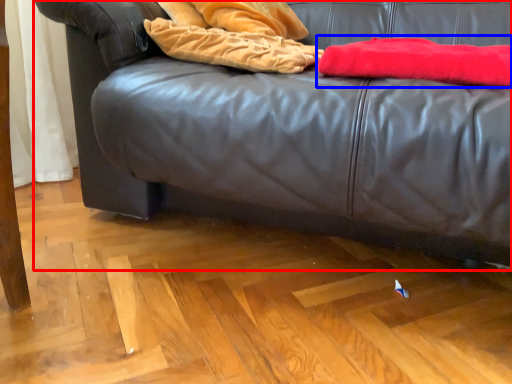
Question: Which point is closer to the camera, studio couch (highlighted by a red box) or blanket (highlighted by a blue box)?

Choices:
 (A) studio couch
 (B) blanket

Answer: (A)